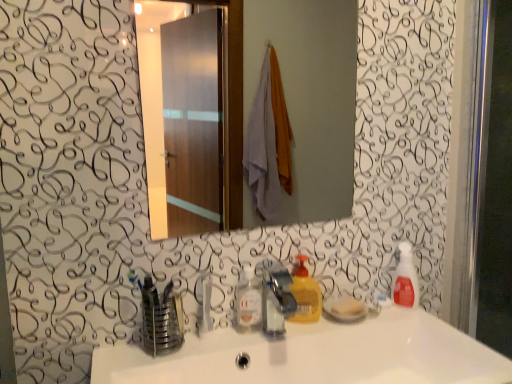
Question: Is satin nickel faucet at center far away from white glossy sink at center?

Choices:
 (A) no
 (B) yes

Answer: (A)

Question: Is the position of satin nickel faucet at center more distant than that of white glossy sink at center?

Choices:
 (A) no
 (B) yes

Answer: (B)

Question: Does satin nickel faucet at center appear on the left side of white glossy sink at center?

Choices:
 (A) no
 (B) yes

Answer: (B)

Question: Is satin nickel faucet at center looking in the opposite direction of white glossy sink at center?

Choices:
 (A) no
 (B) yes

Answer: (A)

Question: Are satin nickel faucet at center and white glossy sink at center making contact?

Choices:
 (A) yes
 (B) no

Answer: (B)

Question: Can you confirm if satin nickel faucet at center is smaller than white glossy sink at center?

Choices:
 (A) yes
 (B) no

Answer: (A)

Question: Is translucent plastic soap dispenser at right at the back of white glossy sink at center?

Choices:
 (A) no
 (B) yes

Answer: (A)

Question: Considering the relative sizes of white glossy sink at center and translucent plastic soap dispenser at right in the image provided, is white glossy sink at center taller than translucent plastic soap dispenser at right?

Choices:
 (A) no
 (B) yes

Answer: (A)

Question: Considering the relative positions of white glossy sink at center and translucent plastic soap dispenser at right in the image provided, is white glossy sink at center to the left of translucent plastic soap dispenser at right from the viewer's perspective?

Choices:
 (A) no
 (B) yes

Answer: (B)

Question: Is white glossy sink at center thinner than translucent plastic soap dispenser at right?

Choices:
 (A) yes
 (B) no

Answer: (B)

Question: Is white glossy sink at center shorter than translucent plastic soap dispenser at right?

Choices:
 (A) yes
 (B) no

Answer: (A)

Question: Can you confirm if white glossy sink at center is smaller than translucent plastic soap dispenser at right?

Choices:
 (A) no
 (B) yes

Answer: (A)

Question: Can you confirm if metallic reflective mirror at center is smaller than yellow matte liquid soap at center?

Choices:
 (A) no
 (B) yes

Answer: (A)